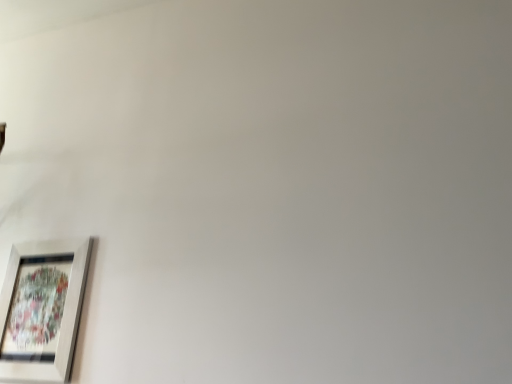
Describe the element at coordinates (42, 309) in the screenshot. The width and height of the screenshot is (512, 384). I see `wooden picture frame at lower left` at that location.

I want to click on wooden picture frame at lower left, so click(42, 309).

Locate an element on the screen. Image resolution: width=512 pixels, height=384 pixels. wooden picture frame at lower left is located at coordinates (42, 309).